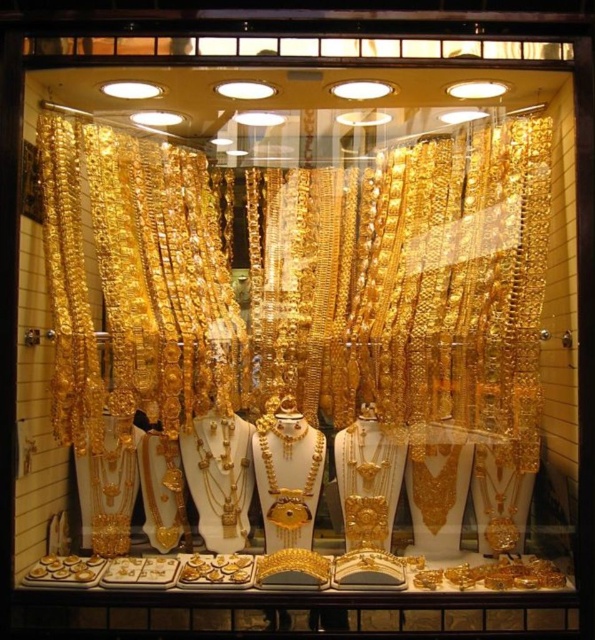
Can you confirm if shiny gold jewelry at center is positioned to the left of gold shiny necklace at center?

In fact, shiny gold jewelry at center is to the right of gold shiny necklace at center.

Is point (236, 369) behind point (234, 460)?

No, it is not.

The height and width of the screenshot is (640, 595). I want to click on shiny gold jewelry at center, so click(305, 330).